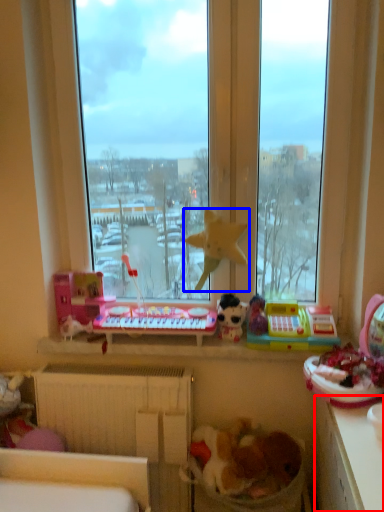
Question: Which object appears farthest to the camera in this image, counter top (highlighted by a red box) or toy (highlighted by a blue box)?

Choices:
 (A) counter top
 (B) toy

Answer: (B)